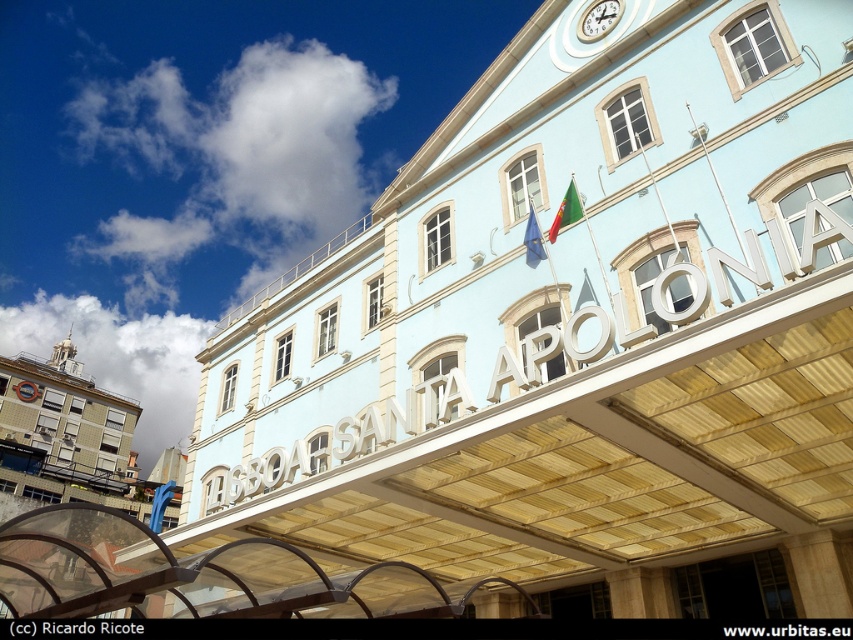
Question: Does white glossy clock at upper center appear on the left side of green fabric flag at upper center?

Choices:
 (A) yes
 (B) no

Answer: (B)

Question: Which object is closer to the camera taking this photo?

Choices:
 (A) brick building at lower left
 (B) european union flag at center

Answer: (B)

Question: Among these points, which one is nearest to the camera?

Choices:
 (A) (619, 1)
 (B) (19, 500)
 (C) (540, 244)

Answer: (C)

Question: Which of the following is the closest to the observer?

Choices:
 (A) european union flag at center
 (B) white glossy clock at upper center
 (C) brick building at lower left
 (D) green fabric flag at upper center

Answer: (D)

Question: Is green fabric flag at upper center positioned at the back of european union flag at center?

Choices:
 (A) no
 (B) yes

Answer: (A)

Question: Does white glossy clock at upper center appear under green fabric flag at upper center?

Choices:
 (A) yes
 (B) no

Answer: (B)